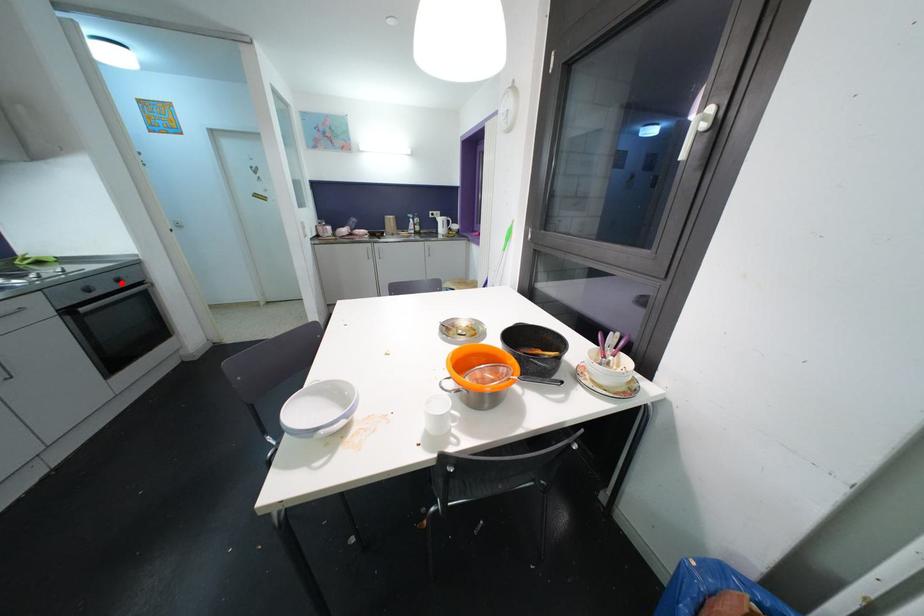
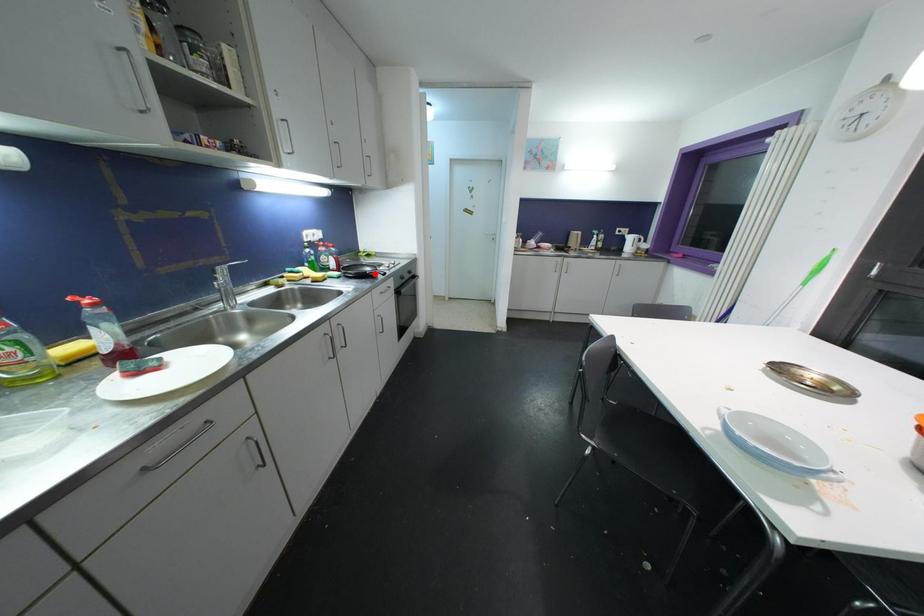
I am providing you with two images of the same scene from different viewpoints. A red point is marked on the first image and another point is marked on the second image. Do the highlighted points in image1 and image2 indicate the same real-world spot?

No